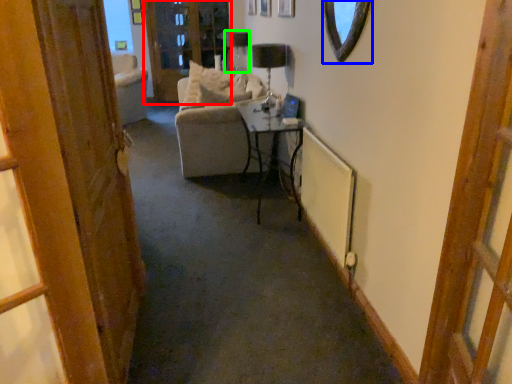
Question: Which is nearer to the screen door (highlighted by a red box)? mirror (highlighted by a blue box) or lamp (highlighted by a green box).

Choices:
 (A) mirror
 (B) lamp

Answer: (B)